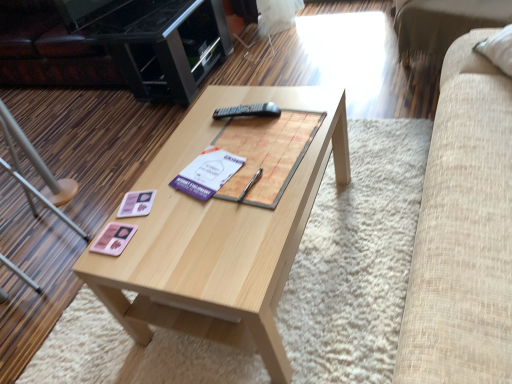
Find the location of a particular element. The width and height of the screenshot is (512, 384). vacant location behind black plastic remote at center is located at coordinates (234, 101).